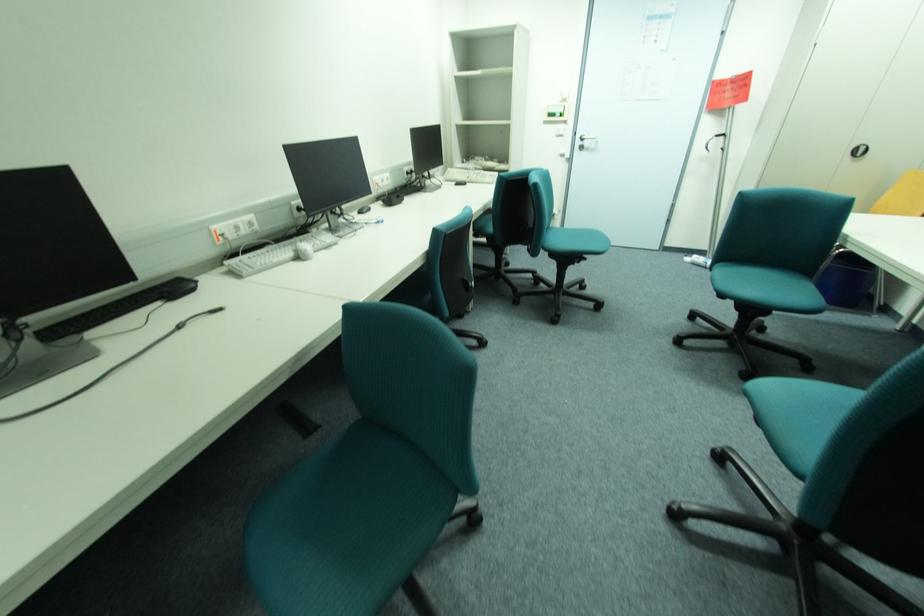
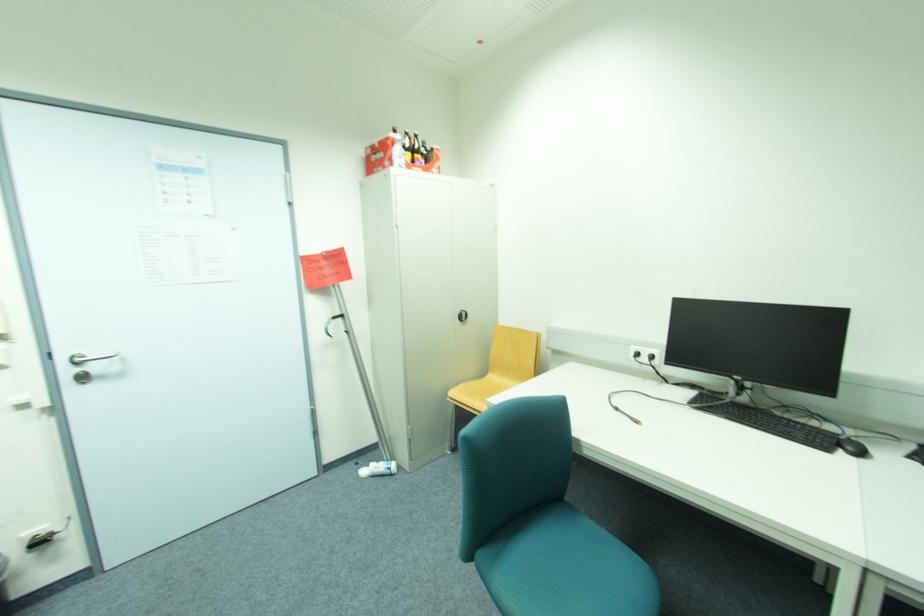
In the second image, find the point that corresponds to the point at 699,257 in the first image.

(373, 468)